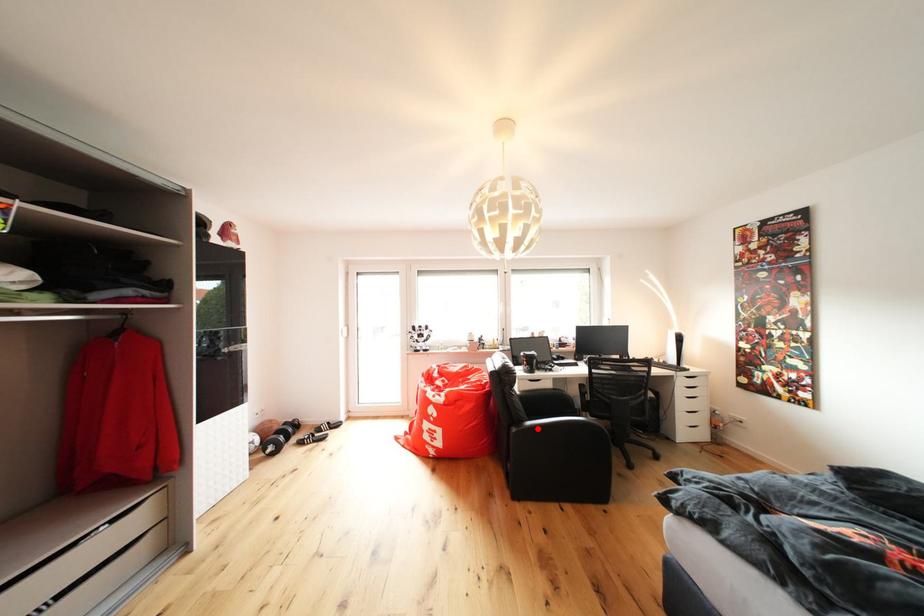
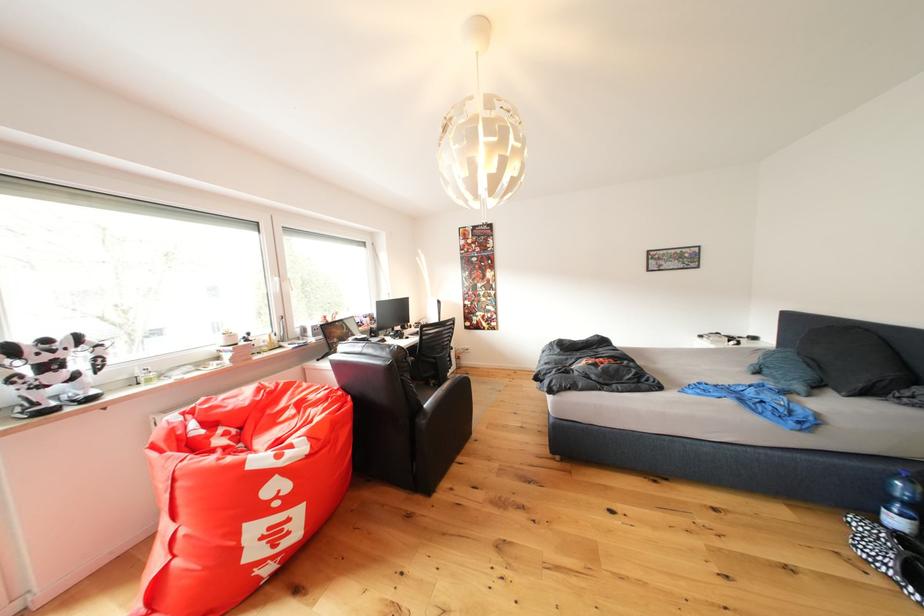
In the second image, find the point that corresponds to the highlighted location in the first image.

(434, 410)